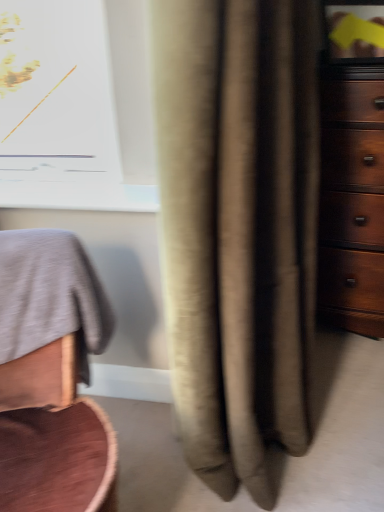
Question: From a real-world perspective, is dark wood dresser at right positioned over beige fabric curtain at center based on gravity?

Choices:
 (A) yes
 (B) no

Answer: (B)

Question: Is dark wood dresser at right surrounding beige fabric curtain at center?

Choices:
 (A) no
 (B) yes

Answer: (A)

Question: Considering the relative sizes of dark wood dresser at right and beige fabric curtain at center in the image provided, is dark wood dresser at right taller than beige fabric curtain at center?

Choices:
 (A) no
 (B) yes

Answer: (A)

Question: Does dark wood dresser at right appear on the right side of beige fabric curtain at center?

Choices:
 (A) no
 (B) yes

Answer: (B)

Question: Is dark wood dresser at right far from beige fabric curtain at center?

Choices:
 (A) yes
 (B) no

Answer: (B)

Question: Is smooth gray fabric at left wider or thinner than dark wood dresser at right?

Choices:
 (A) wide
 (B) thin

Answer: (A)

Question: Relative to dark wood dresser at right, is smooth gray fabric at left in front or behind?

Choices:
 (A) behind
 (B) front

Answer: (B)

Question: Is point (28, 391) positioned closer to the camera than point (342, 0)?

Choices:
 (A) closer
 (B) farther

Answer: (A)

Question: Would you say smooth gray fabric at left is inside or outside dark wood dresser at right?

Choices:
 (A) outside
 (B) inside

Answer: (A)

Question: From a real-world perspective, relative to beige fabric curtain at center, is dark wood dresser at right vertically above or below?

Choices:
 (A) below
 (B) above

Answer: (A)

Question: Considering the positions of dark wood dresser at right and beige fabric curtain at center in the image, is dark wood dresser at right bigger or smaller than beige fabric curtain at center?

Choices:
 (A) big
 (B) small

Answer: (B)

Question: From their relative heights in the image, would you say dark wood dresser at right is taller or shorter than beige fabric curtain at center?

Choices:
 (A) tall
 (B) short

Answer: (B)

Question: Considering the positions of point click(x=382, y=98) and point click(x=306, y=268), is point click(x=382, y=98) closer or farther from the camera than point click(x=306, y=268)?

Choices:
 (A) farther
 (B) closer

Answer: (A)

Question: Looking at their shapes, would you say dark wood dresser at right is wider or thinner than smooth gray fabric at left?

Choices:
 (A) thin
 (B) wide

Answer: (A)

Question: Is dark wood dresser at right spatially inside smooth gray fabric at left, or outside of it?

Choices:
 (A) inside
 (B) outside

Answer: (B)